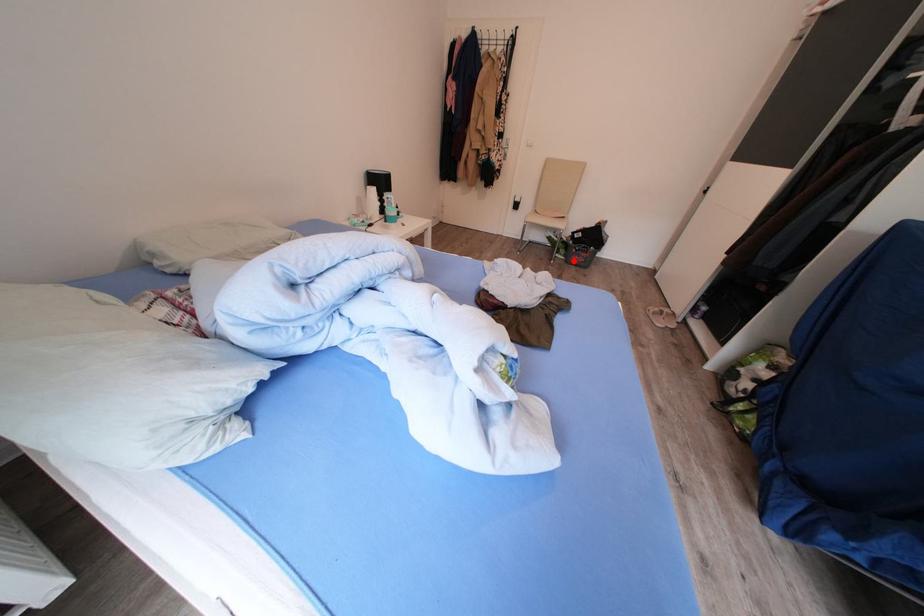
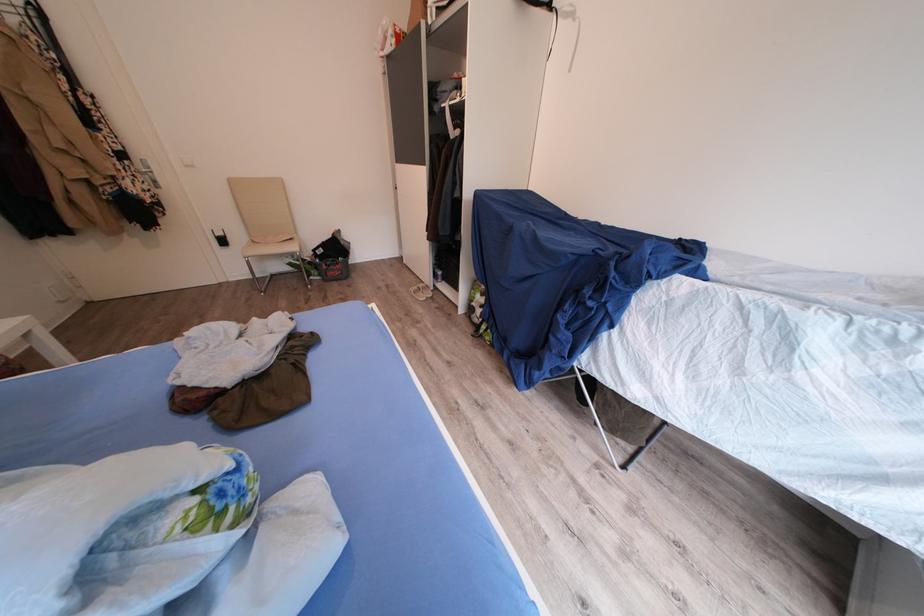
In the second image, find the point that corresponds to the highlighted location in the first image.

(329, 281)